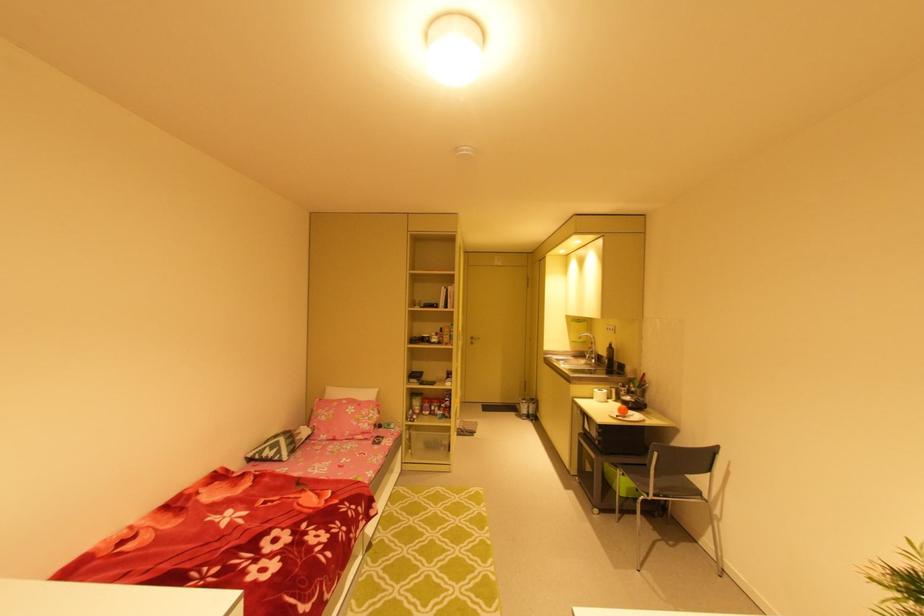
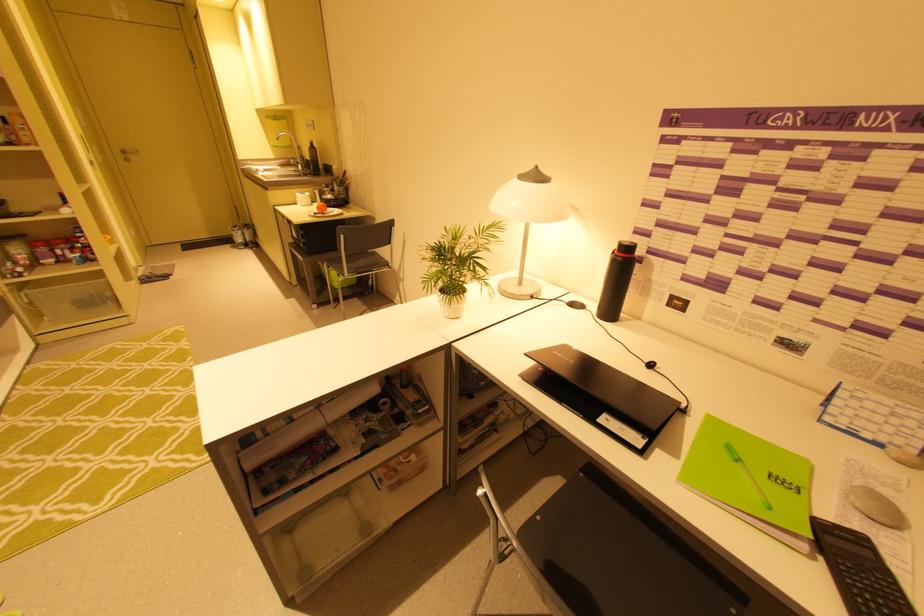
The point at (631, 474) is marked in the first image. Where is the corresponding point in the second image?

(334, 265)